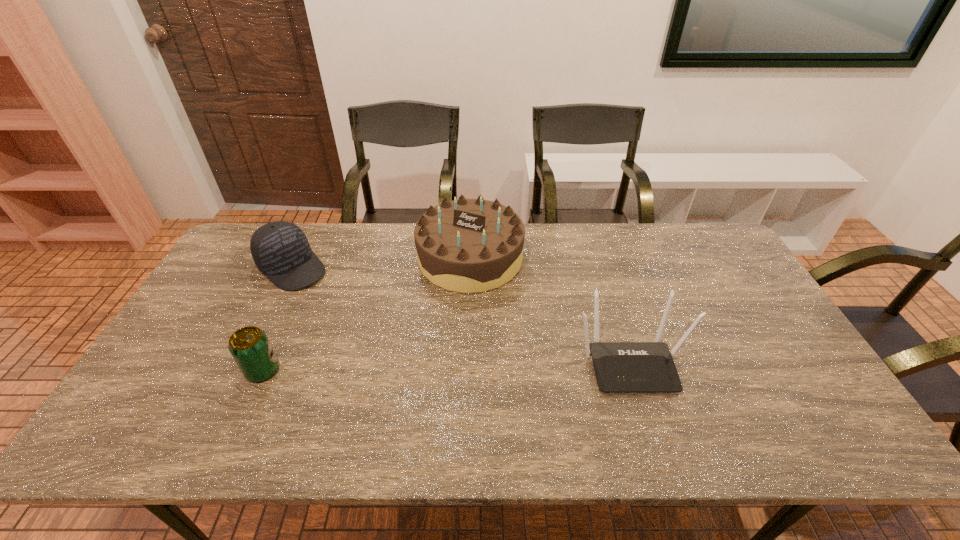
This screenshot has height=540, width=960. I want to click on vacant position located 0.070m on the front-facing side of the third object from left to right, so click(462, 311).

The height and width of the screenshot is (540, 960). Identify the location of baseball cap located at the far edge. (280, 249).

You are a GUI agent. You are given a task and a screenshot of the screen. Output one action in this format:
    pyautogui.click(x=<x>, y=<y>)
    Task: Click on the birthday cake at the far edge
    The height and width of the screenshot is (540, 960).
    Given the screenshot: What is the action you would take?
    pyautogui.click(x=467, y=245)

Image resolution: width=960 pixels, height=540 pixels. In order to click on beer can that is at the near edge in this screenshot , I will do tap(249, 346).

What are the coordinates of `router located at the near edge` in the screenshot? It's located at (620, 367).

Identify the location of object at the left edge. (280, 249).

I want to click on object situated at the far left corner, so click(x=280, y=249).

This screenshot has width=960, height=540. I want to click on vacant space at the far edge of the desktop, so click(538, 224).

In the image, there is a desktop. Find the location of `vacant space at the near edge`. vacant space at the near edge is located at coordinates (714, 405).

Identify the location of blank space at the left edge. Image resolution: width=960 pixels, height=540 pixels. (261, 280).